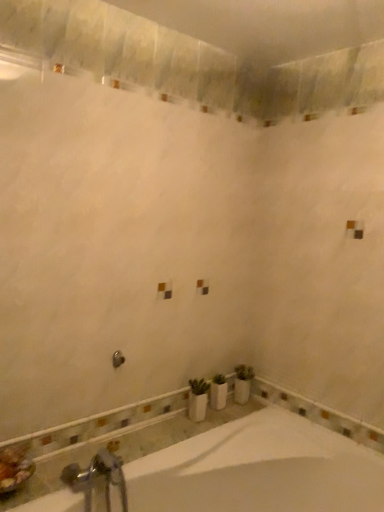
Locate an element on the screen. The width and height of the screenshot is (384, 512). free point in front of white ceramic vase at lower center is located at coordinates (231, 406).